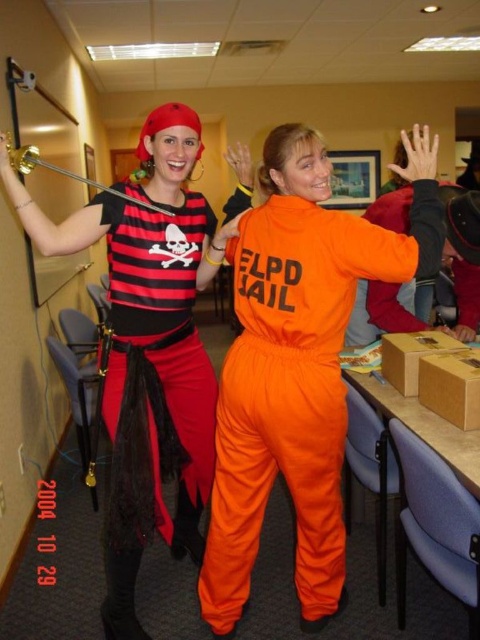
You are a photographer at the event and want to position a spotlight exactly where the orange matte jumpsuit at center is located. According to the coordinates provided, what are the exact coordinates where you should aim the spotlight?

The exact coordinates for the orange matte jumpsuit at center are at point (298, 365).

You are at a costume party and need to find the prisoner. You see the orange matte jumpsuit at center and the matte black pirate costume at left. Which one is the prisoner?

The orange matte jumpsuit at center is the prisoner because it has the ELPD JAIL text on the back, indicating it is a prisoner costume, while the matte black pirate costume at left is a pirate.